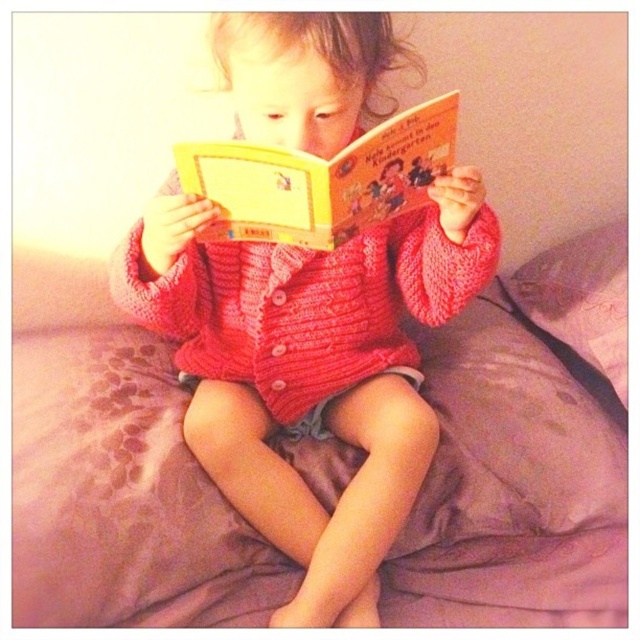
Is pink fabric bed at center positioned at the back of knitted red sweater at center?

That is False.

Does pink fabric bed at center have a greater width compared to knitted red sweater at center?

Yes, pink fabric bed at center is wider than knitted red sweater at center.

Is point (547, 548) less distant than point (285, 321)?

Yes.

I want to click on pink fabric bed at center, so tap(524, 452).

Is yellow paper at center positioned behind purple soft pillow at upper right?

That is False.

Which is more to the right, yellow paper at center or purple soft pillow at upper right?

Positioned to the right is purple soft pillow at upper right.

Is point (429, 148) in front of point (564, 308)?

Yes.

Where is `yellow paper at center`? yellow paper at center is located at coordinates (321, 179).

Between point (116, 400) and point (189, 147), which one is positioned behind?

Positioned behind is point (116, 400).

At what (x,y) coordinates should I click in order to perform the action: click on pink fabric bed at center. Please return your answer as a coordinate pair (x, y). Image resolution: width=640 pixels, height=640 pixels. Looking at the image, I should click on (524, 452).